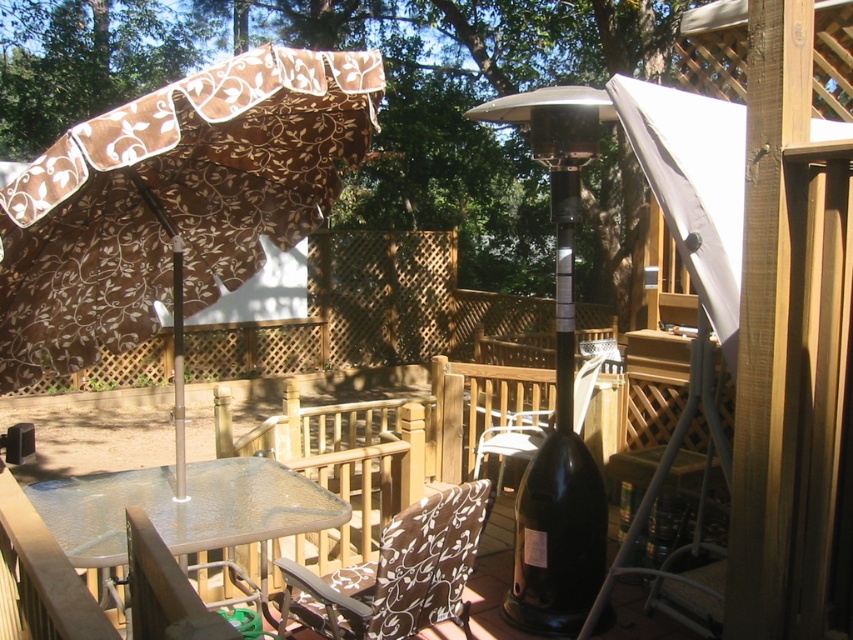
Between white fabric canopy at upper right and brown fabric chair at lower center, which one is positioned higher?

Positioned higher is white fabric canopy at upper right.

Is white fabric canopy at upper right behind brown fabric chair at lower center?

Yes, it is behind brown fabric chair at lower center.

Describe the element at coordinates (694, 186) in the screenshot. I see `white fabric canopy at upper right` at that location.

Identify the location of white fabric canopy at upper right. (694, 186).

Between black glass bottle at center and brown fabric chair at lower center, which one is positioned higher?

black glass bottle at center

Which is more to the right, black glass bottle at center or brown fabric chair at lower center?

From the viewer's perspective, black glass bottle at center appears more on the right side.

Image resolution: width=853 pixels, height=640 pixels. Describe the element at coordinates (556, 387) in the screenshot. I see `black glass bottle at center` at that location.

Image resolution: width=853 pixels, height=640 pixels. In order to click on black glass bottle at center in this screenshot , I will do `click(556, 387)`.

Looking at this image, between transparent glass table at lower center and black matte wine bottle at lower center, which one is positioned lower?

black matte wine bottle at lower center is lower down.

Which of these two, transparent glass table at lower center or black matte wine bottle at lower center, stands taller?

With more height is black matte wine bottle at lower center.

Locate an element on the screen. transparent glass table at lower center is located at coordinates (183, 508).

At what (x,y) coordinates should I click in order to perform the action: click on transparent glass table at lower center. Please return your answer as a coordinate pair (x, y). Image resolution: width=853 pixels, height=640 pixels. Looking at the image, I should click on (183, 508).